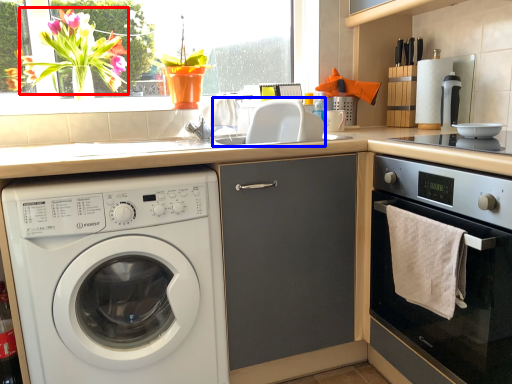
Question: Among these objects, which one is farthest to the camera, flower (highlighted by a red box) or sink (highlighted by a blue box)?

Choices:
 (A) flower
 (B) sink

Answer: (A)